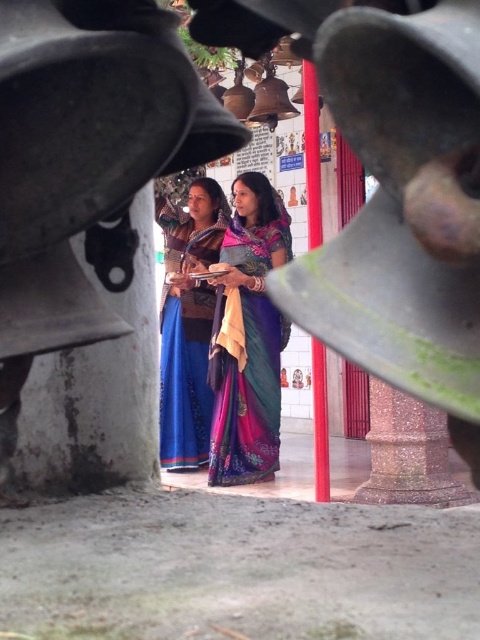
You are an observer looking through the metallic bells. You notice two women in the midground wearing traditional attire. Which of the two items, the silky blue sari at center or the blue silk saree at center, is positioned lower in the scene?

The silky blue sari at center is located below the blue silk saree at center, so the silky blue sari at center is positioned lower in the scene.

You are an observer looking through the metallic bells. There are two women in the scene wearing a silky blue sari at center and a blue silk saree at center. Which one is closer to you?

The silky blue sari at center is closer to you because it is in front of the blue silk saree at center.

You are standing in front of the metallic bells and looking at the scene through them. There is a point marked at coordinates [248,337]. What object is located at that point?

The silky blue sari at center is located at point [248,337].